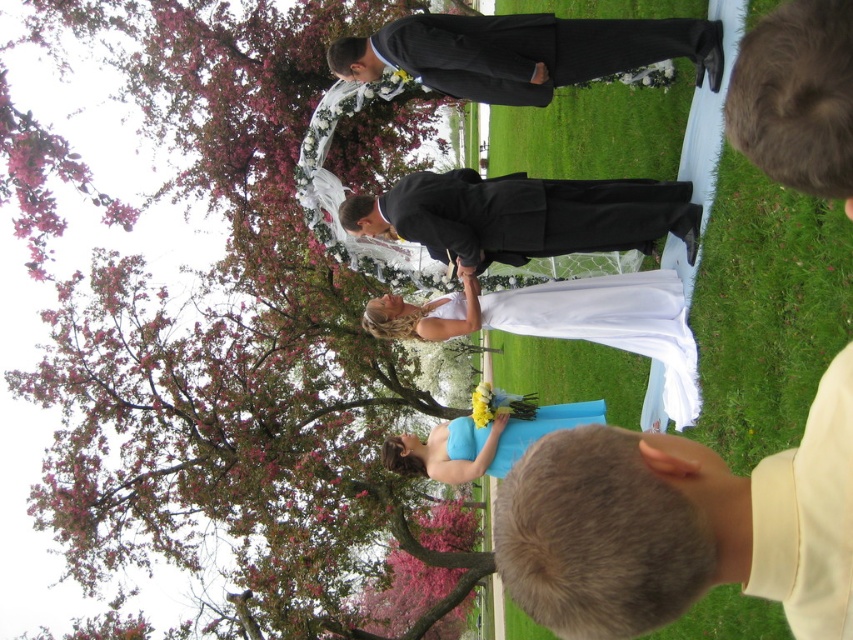
You are a photographer at the wedding. You need to adjust your camera to focus on the matte black suit at center. What are the coordinates where you should aim your camera?

The coordinates for the matte black suit at center are at point (680, 525).

In the wedding scene described, where is the pink blossoming tree at upper left in relation to the black pinstripe suit at center?

The pink blossoming tree at upper left is located to the left of the black pinstripe suit at center.